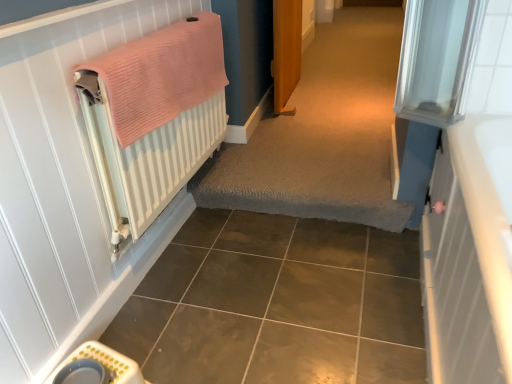
Question: From a real-world perspective, is pink knitted towel at left above or below white textured radiator at left?

Choices:
 (A) above
 (B) below

Answer: (A)

Question: Is pink knitted towel at left taller or shorter than white textured radiator at left?

Choices:
 (A) short
 (B) tall

Answer: (A)

Question: Which object is positioned closest to the pink knitted towel at left?

Choices:
 (A) textured carpet at center
 (B) white textured radiator at left
 (C) brown glossy ceramic tile at lower center

Answer: (B)

Question: Estimate the real-world distances between objects in this image. Which object is farther from the textured carpet at center?

Choices:
 (A) brown glossy ceramic tile at lower center
 (B) white textured radiator at left
 (C) pink knitted towel at left

Answer: (C)